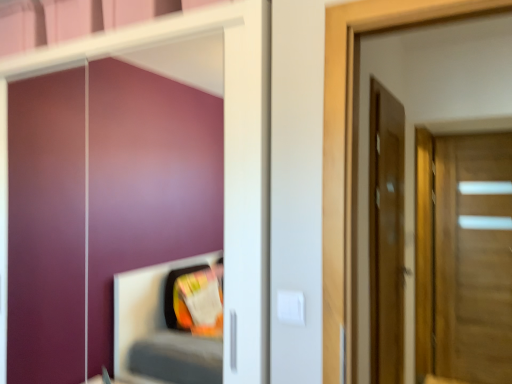
The image size is (512, 384). Find the location of `wooden door at right, which is counted as the 2th door, starting from the left`. wooden door at right, which is counted as the 2th door, starting from the left is located at coordinates (473, 257).

The width and height of the screenshot is (512, 384). Describe the element at coordinates (473, 257) in the screenshot. I see `wooden door at right, the 2th door from the front` at that location.

What is the approximate width of wooden door at right, which is counted as the 2th door, starting from the left?

The width of wooden door at right, which is counted as the 2th door, starting from the left, is 4.67 inches.

Find the location of a particular element. matte wooden door at right, positioned as the first door in front-to-back order is located at coordinates (386, 235).

Describe the element at coordinates (386, 235) in the screenshot. The height and width of the screenshot is (384, 512). I see `matte wooden door at right, positioned as the first door in front-to-back order` at that location.

Locate an element on the screen. The image size is (512, 384). wooden door at right, the first door from the right is located at coordinates (473, 257).

In the image, is wooden door at right, the 2th door from the front, on the left side or the right side of matte wooden door at right, the 2th door in the right-to-left sequence?

Clearly, wooden door at right, the 2th door from the front, is on the right of matte wooden door at right, the 2th door in the right-to-left sequence, in the image.

Which object is further away from the camera, wooden door at right, which is the 1th door from back to front, or matte wooden door at right, positioned as the first door in front-to-back order?

wooden door at right, which is the 1th door from back to front, is further away from the camera.

Does point (462, 249) lie behind point (392, 193)?

Yes, point (462, 249) is farther from viewer.

From the image's perspective, between wooden door at right, which is counted as the 2th door, starting from the left, and matte wooden door at right, acting as the 2th door starting from the back, which one is located above?

matte wooden door at right, acting as the 2th door starting from the back, from the image's perspective.

From a real-world perspective, who is located higher, wooden door at right, which is the 1th door from back to front, or matte wooden door at right, the 2th door in the right-to-left sequence?

matte wooden door at right, the 2th door in the right-to-left sequence, from a real-world perspective.

Does wooden door at right, the first door from the right, have a lesser width compared to matte wooden door at right, placed as the 1th door when sorted from left to right?

No.

Considering the relative sizes of wooden door at right, the first door from the right, and matte wooden door at right, the 2th door in the right-to-left sequence, in the image provided, is wooden door at right, the first door from the right, taller than matte wooden door at right, the 2th door in the right-to-left sequence,?

Indeed, wooden door at right, the first door from the right, has a greater height compared to matte wooden door at right, the 2th door in the right-to-left sequence.

Considering the sizes of wooden door at right, which is counted as the 2th door, starting from the left, and matte wooden door at right, placed as the 1th door when sorted from left to right, in the image, is wooden door at right, which is counted as the 2th door, starting from the left, bigger or smaller than matte wooden door at right, placed as the 1th door when sorted from left to right,?

In the image, wooden door at right, which is counted as the 2th door, starting from the left, appears to be larger than matte wooden door at right, placed as the 1th door when sorted from left to right.

Can matte wooden door at right, placed as the 1th door when sorted from left to right, be found inside wooden door at right, which is the 1th door from back to front?

No.

Consider the image. Are wooden door at right, the first door from the right, and matte wooden door at right, the 2th door in the right-to-left sequence, far apart?

Yes, wooden door at right, the first door from the right, and matte wooden door at right, the 2th door in the right-to-left sequence, are located far from each other.

Could you tell me if wooden door at right, the 2th door from the front, is turned towards matte wooden door at right, the 2th door in the right-to-left sequence?

Yes, wooden door at right, the 2th door from the front, faces towards matte wooden door at right, the 2th door in the right-to-left sequence.

The image size is (512, 384). In order to click on door that appears on the right of matte wooden door at right, positioned as the first door in front-to-back order in this screenshot , I will do `click(473, 257)`.

Is matte wooden door at right, placed as the 1th door when sorted from left to right, to the left or to the right of wooden door at right, the 2th door from the front, in the image?

From the image, it's evident that matte wooden door at right, placed as the 1th door when sorted from left to right, is to the left of wooden door at right, the 2th door from the front.

Which object is closer to the camera taking this photo, matte wooden door at right, acting as the 2th door starting from the back, or wooden door at right, which is counted as the 2th door, starting from the left?

matte wooden door at right, acting as the 2th door starting from the back, is in front.

Considering the positions of point (399, 226) and point (503, 291), is point (399, 226) closer or farther from the camera than point (503, 291)?

Clearly, point (399, 226) is closer to the camera than point (503, 291).

From the picture: From the image's perspective, is matte wooden door at right, the 2th door in the right-to-left sequence, located beneath wooden door at right, which is the 1th door from back to front?

Actually, matte wooden door at right, the 2th door in the right-to-left sequence, appears above wooden door at right, which is the 1th door from back to front, in the image.

From a real-world perspective, is matte wooden door at right, placed as the 1th door when sorted from left to right, positioned under wooden door at right, which is counted as the 2th door, starting from the left, based on gravity?

Incorrect, from a real-world perspective, matte wooden door at right, placed as the 1th door when sorted from left to right, is higher than wooden door at right, which is counted as the 2th door, starting from the left.

Which of these two, matte wooden door at right, the 2th door in the right-to-left sequence, or wooden door at right, the first door from the right, is wider?

wooden door at right, the first door from the right.

Considering the sizes of objects matte wooden door at right, positioned as the first door in front-to-back order, and wooden door at right, the 2th door from the front, in the image provided, who is taller, matte wooden door at right, positioned as the first door in front-to-back order, or wooden door at right, the 2th door from the front,?

wooden door at right, the 2th door from the front.

In terms of size, does matte wooden door at right, acting as the 2th door starting from the back, appear bigger or smaller than wooden door at right, the first door from the right?

Clearly, matte wooden door at right, acting as the 2th door starting from the back, is smaller in size than wooden door at right, the first door from the right.

Is matte wooden door at right, acting as the 2th door starting from the back, surrounding wooden door at right, the 2th door from the front?

That's incorrect, wooden door at right, the 2th door from the front, is not inside matte wooden door at right, acting as the 2th door starting from the back.

Is matte wooden door at right, the 2th door in the right-to-left sequence, far from wooden door at right, which is counted as the 2th door, starting from the left?

Yes, matte wooden door at right, the 2th door in the right-to-left sequence, and wooden door at right, which is counted as the 2th door, starting from the left, are quite far apart.

Is matte wooden door at right, placed as the 1th door when sorted from left to right, turned away from wooden door at right, which is counted as the 2th door, starting from the left?

No, wooden door at right, which is counted as the 2th door, starting from the left, is not at the back of matte wooden door at right, placed as the 1th door when sorted from left to right.

Can you tell me how much matte wooden door at right, positioned as the first door in front-to-back order, and wooden door at right, which is the 1th door from back to front, differ in facing direction?

88.1 degrees.

This screenshot has width=512, height=384. In order to click on door on the right of matte wooden door at right, positioned as the first door in front-to-back order in this screenshot , I will do `click(473, 257)`.

Image resolution: width=512 pixels, height=384 pixels. In order to click on door below the matte wooden door at right, positioned as the first door in front-to-back order (from the image's perspective) in this screenshot , I will do `click(473, 257)`.

The width and height of the screenshot is (512, 384). Find the location of `door behind the matte wooden door at right, positioned as the first door in front-to-back order`. door behind the matte wooden door at right, positioned as the first door in front-to-back order is located at coordinates (473, 257).